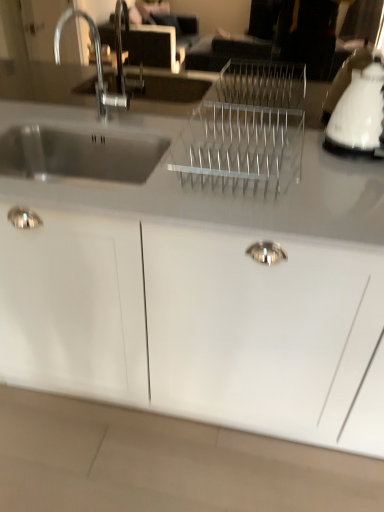
Question: From a real-world perspective, is white glossy cabinet at center positioned above or below white glossy kettle at upper right?

Choices:
 (A) above
 (B) below

Answer: (B)

Question: From the image's perspective, is white glossy cabinet at center above or below white glossy kettle at upper right?

Choices:
 (A) above
 (B) below

Answer: (B)

Question: Is point (291, 433) positioned closer to the camera than point (332, 137)?

Choices:
 (A) farther
 (B) closer

Answer: (A)

Question: From a real-world perspective, is white glossy kettle at upper right above or below white glossy cabinet at center?

Choices:
 (A) above
 (B) below

Answer: (A)

Question: Considering the positions of white glossy kettle at upper right and white glossy cabinet at center in the image, is white glossy kettle at upper right wider or thinner than white glossy cabinet at center?

Choices:
 (A) thin
 (B) wide

Answer: (A)

Question: Based on their positions, is white glossy kettle at upper right located to the left or right of white glossy cabinet at center?

Choices:
 (A) right
 (B) left

Answer: (A)

Question: From the image's perspective, is white glossy kettle at upper right located above or below white glossy cabinet at center?

Choices:
 (A) below
 (B) above

Answer: (B)